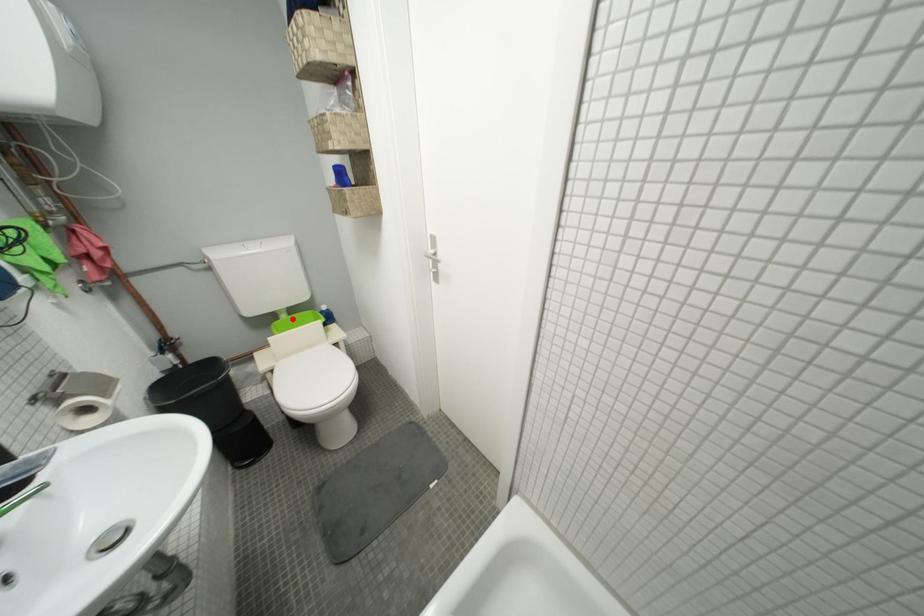
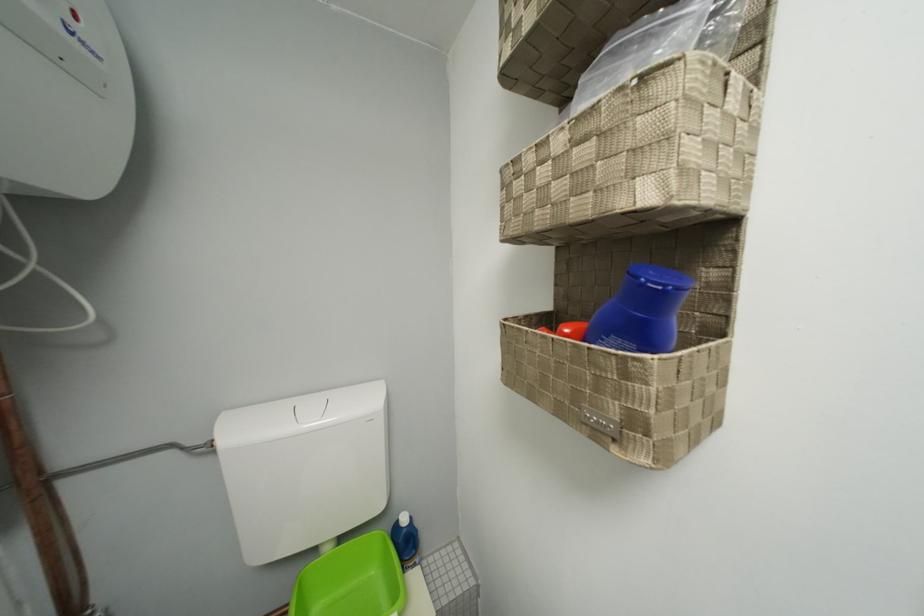
Question: I am providing you with two images of the same scene from different viewpoints. Given a red point in image1, look at the same physical point in image2. Is it:

Choices:
 (A) Closer to the viewpoint
 (B) Farther from the viewpoint

Answer: (B)